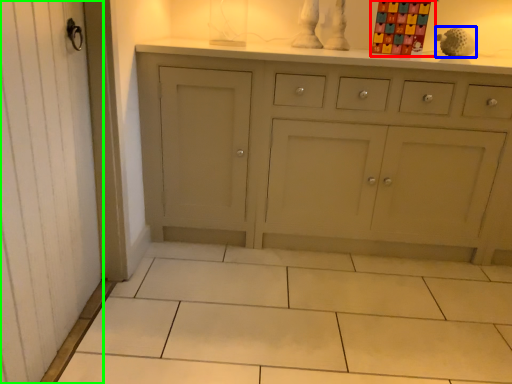
Question: Which is nearer to the toy (highlighted by a red box)? toy (highlighted by a blue box) or screen door (highlighted by a green box).

Choices:
 (A) toy
 (B) screen door

Answer: (A)